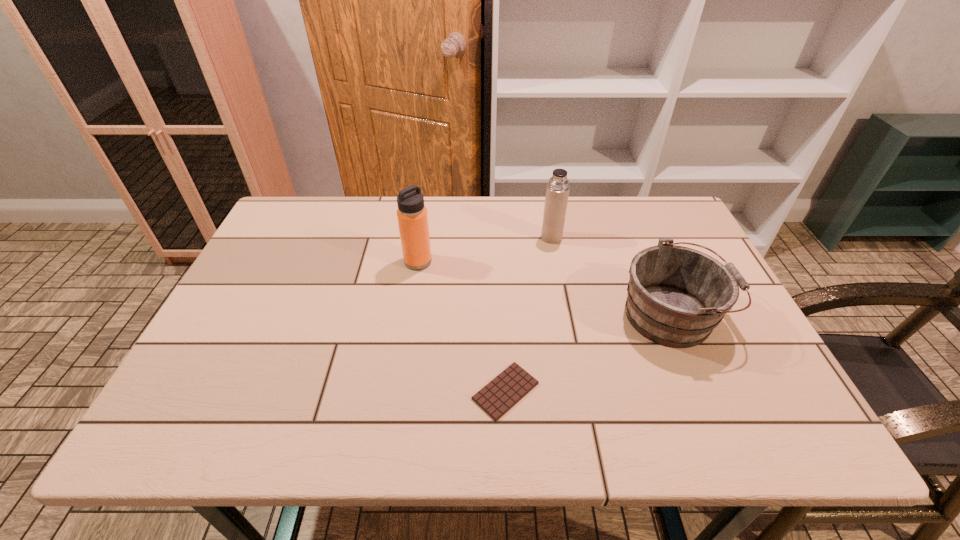
Identify the location of vacant space at the near right corner of the desktop. This screenshot has width=960, height=540. (732, 404).

Where is `free point between the second farthest object and the chocolate bar`? free point between the second farthest object and the chocolate bar is located at coordinates (462, 326).

Find the location of a particular element. Image resolution: width=960 pixels, height=540 pixels. free space between the chocolate bar and the second farthest object is located at coordinates (462, 326).

Find the location of `free space between the nearest object and the rightmost object`. free space between the nearest object and the rightmost object is located at coordinates (588, 353).

Locate an element on the screen. Image resolution: width=960 pixels, height=540 pixels. unoccupied area between the third farthest object and the farthest object is located at coordinates (612, 276).

In order to click on free spot between the farthest object and the leftmost object in this screenshot , I will do `click(485, 249)`.

I want to click on free space that is in between the nearer thermos bottle and the second object from left to right, so click(x=462, y=326).

At what (x,y) coordinates should I click in order to perform the action: click on empty location between the right thermos bottle and the nearer thermos bottle. Please return your answer as a coordinate pair (x, y). Looking at the image, I should click on (485, 249).

Image resolution: width=960 pixels, height=540 pixels. What are the coordinates of `free point between the third nearest object and the shortest object` in the screenshot? It's located at (462, 326).

You are a GUI agent. You are given a task and a screenshot of the screen. Output one action in this format:
    pyautogui.click(x=<x>, y=<y>)
    Task: Click on the unoccupied area between the rightmost object and the farthest object
    
    Given the screenshot: What is the action you would take?
    pyautogui.click(x=612, y=276)